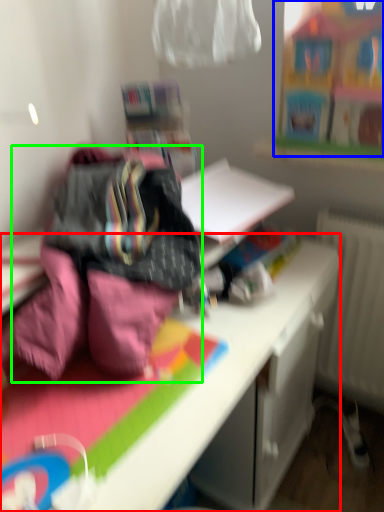
Question: Which is nearer to the desk (highlighted by a red box)? toy (highlighted by a blue box) or bedding (highlighted by a green box).

Choices:
 (A) toy
 (B) bedding

Answer: (B)